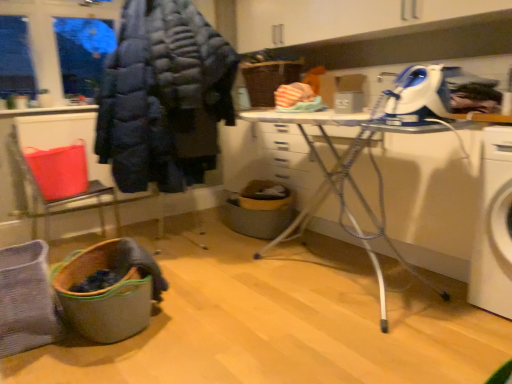
Locate an element on the screen. The height and width of the screenshot is (384, 512). unoccupied region to the right of matte plastic chair at lower left is located at coordinates (159, 238).